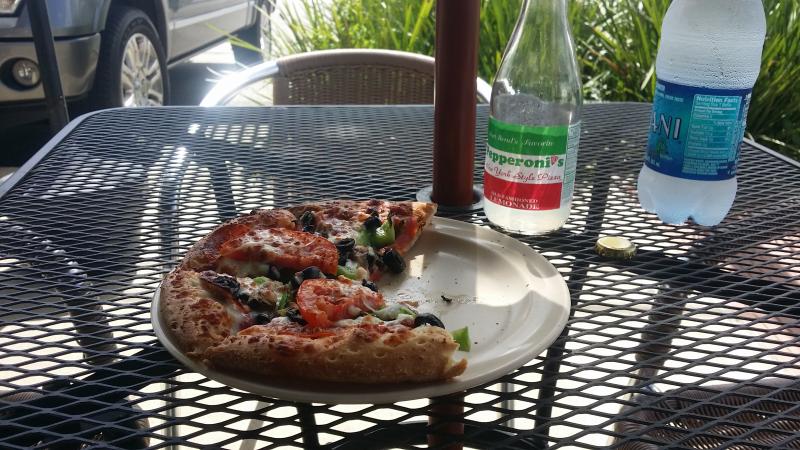
I want to click on plate, so click(500, 304).